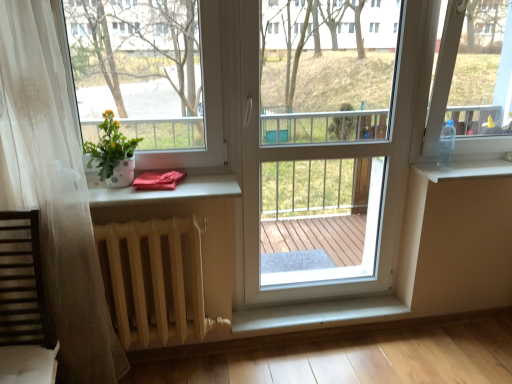
Where is `vacant space underneath white plastic screen door at center (from a real-world perspective)`? vacant space underneath white plastic screen door at center (from a real-world perspective) is located at coordinates pos(327,307).